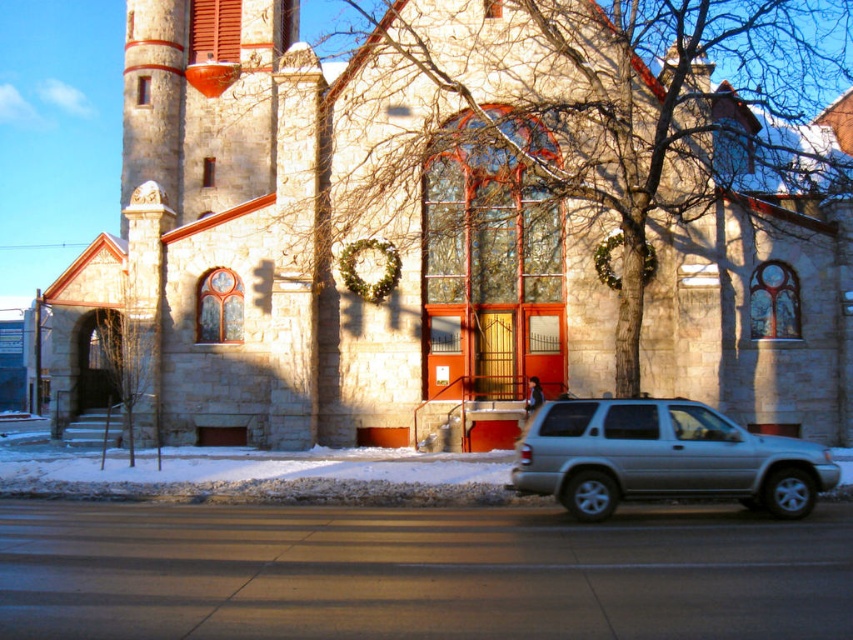
Who is positioned more to the right, stone church at center or silver metallic suv at lower right?

From the viewer's perspective, silver metallic suv at lower right appears more on the right side.

Is point (210, 240) farther from viewer compared to point (767, 470)?

Yes, it is behind point (767, 470).

You are a GUI agent. You are given a task and a screenshot of the screen. Output one action in this format:
    pyautogui.click(x=<x>, y=<y>)
    Task: Click on the stone church at center
    Image resolution: width=853 pixels, height=640 pixels.
    Given the screenshot: What is the action you would take?
    pyautogui.click(x=318, y=250)